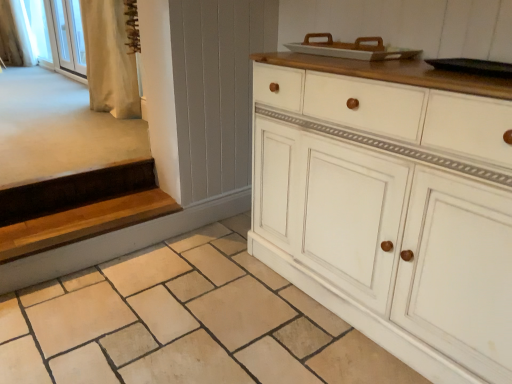
Where is `free spot to the left of beige fabric curtain at upper left, the 1th curtain positioned from the front`? This screenshot has height=384, width=512. free spot to the left of beige fabric curtain at upper left, the 1th curtain positioned from the front is located at coordinates (45, 112).